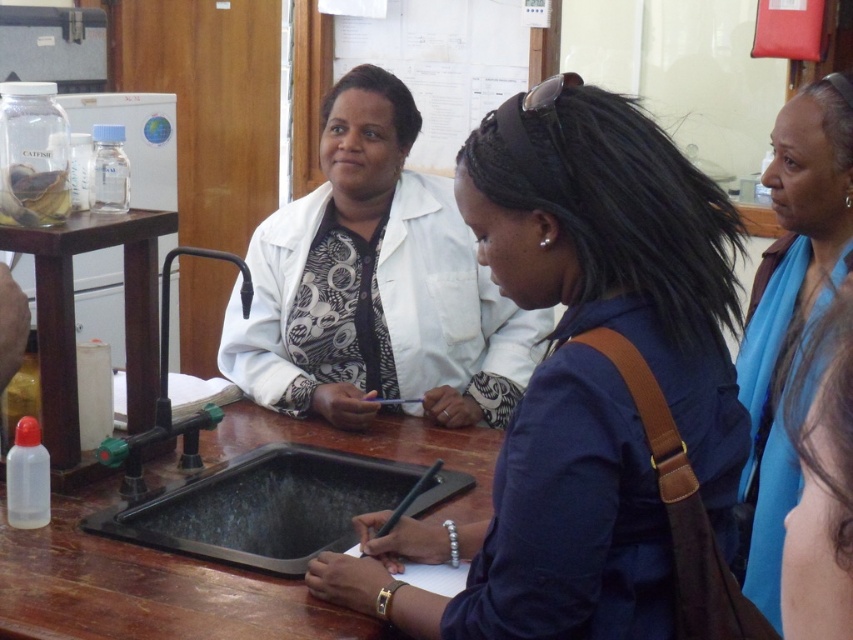
You are standing in the laboratory and need to locate the white lab coat at center. According to the coordinates provided, where would you find it?

The white lab coat at center is located at coordinates point [375,284].

You are a visitor in this lab and need to locate the blue scarf at upper right. Is it in front of or behind the white lab coat at center?

The blue scarf at upper right is behind the white lab coat at center.